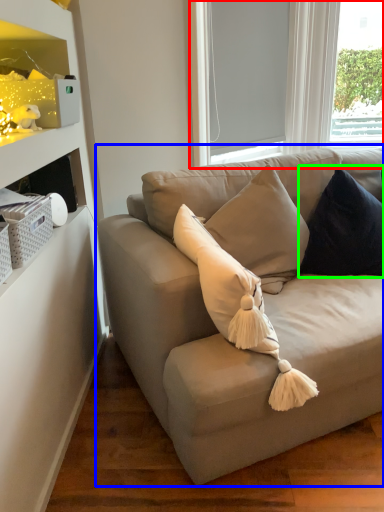
Question: Considering the real-world distances, which object is farthest from bay window (highlighted by a red box)? studio couch (highlighted by a blue box) or pillow (highlighted by a green box)?

Choices:
 (A) studio couch
 (B) pillow

Answer: (A)